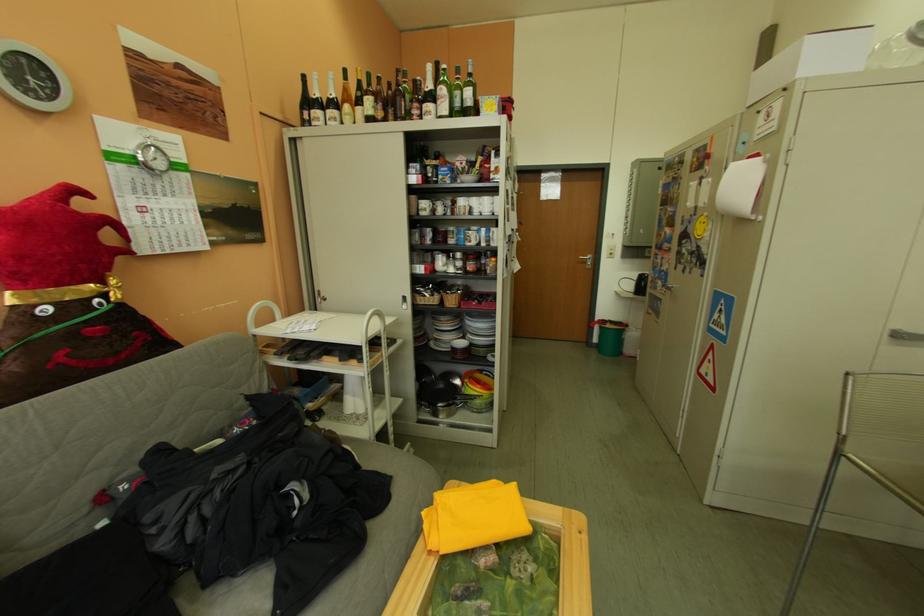
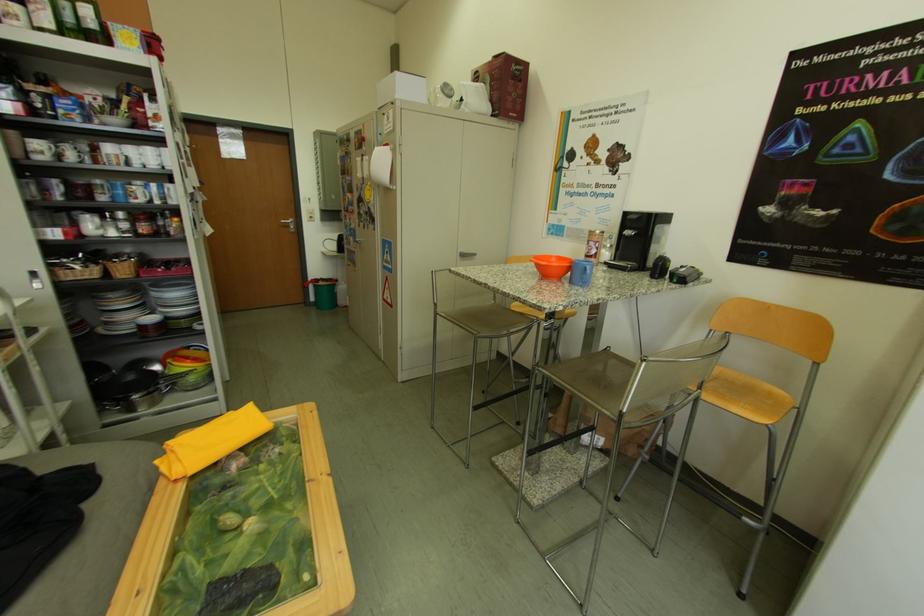
Question: The first image is from the beginning of the video and the second image is from the end. How did the camera likely rotate when shooting the video?

Choices:
 (A) Left
 (B) Right
 (C) Up
 (D) Down

Answer: (B)